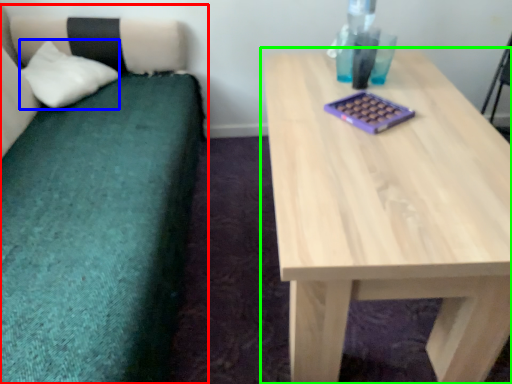
Question: Which object is positioned closest to studio couch (highlighted by a red box)? Select from pillow (highlighted by a blue box) and table (highlighted by a green box).

Choices:
 (A) pillow
 (B) table

Answer: (A)